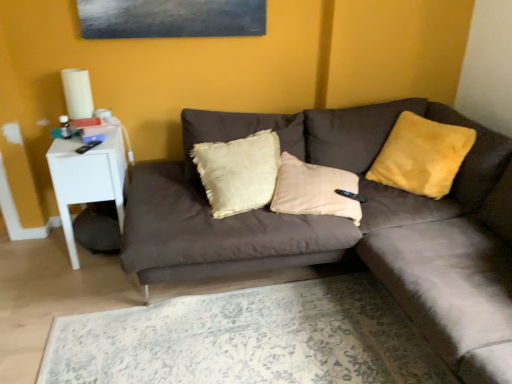
Where is `yellow fuzzy pillow at upper right`? The image size is (512, 384). yellow fuzzy pillow at upper right is located at coordinates (422, 156).

Identify the location of yellow fuzzy pillow at upper right. The width and height of the screenshot is (512, 384). (422, 156).

Considering the sizes of white glossy side table at left and yellow fuzzy pillow at upper right in the image, is white glossy side table at left bigger or smaller than yellow fuzzy pillow at upper right?

Considering their sizes, white glossy side table at left takes up more space than yellow fuzzy pillow at upper right.

Which is correct: white glossy side table at left is inside yellow fuzzy pillow at upper right, or outside of it?

white glossy side table at left is not enclosed by yellow fuzzy pillow at upper right.

Is white glossy side table at left wider or thinner than yellow fuzzy pillow at upper right?

Considering their sizes, white glossy side table at left looks broader than yellow fuzzy pillow at upper right.

From the image's perspective, which is below, white glossy side table at left or yellow fuzzy pillow at upper right?

white glossy side table at left is shown below in the image.

Is velvet brown couch at center turned away from white glossy side table at left?

velvet brown couch at center does not have its back to white glossy side table at left.

Which is more to the left, velvet brown couch at center or white glossy side table at left?

Positioned to the left is white glossy side table at left.

This screenshot has height=384, width=512. Find the location of `table on the left of velvet brown couch at center`. table on the left of velvet brown couch at center is located at coordinates (88, 178).

Is white glossy side table at left closer to camera compared to velvet brown couch at center?

No, it is behind velvet brown couch at center.

Which is correct: white glossy side table at left is inside velvet brown couch at center, or outside of it?

white glossy side table at left cannot be found inside velvet brown couch at center.

From a real-world perspective, who is located lower, white glossy side table at left or velvet brown couch at center?

In real-world perspective, white glossy side table at left is lower.

Based on the photo, how many degrees apart are the facing directions of white glossy side table at left and velvet brown couch at center?

The angle between the facing direction of white glossy side table at left and the facing direction of velvet brown couch at center is 87.5 degrees.

Is velvet brown couch at center closer to camera compared to yellow fuzzy pillow at upper right?

Yes, it is in front of yellow fuzzy pillow at upper right.

Could yellow fuzzy pillow at upper right be considered to be inside velvet brown couch at center?

Absolutely, yellow fuzzy pillow at upper right is inside velvet brown couch at center.

Does velvet brown couch at center have a larger size compared to yellow fuzzy pillow at upper right?

Indeed, velvet brown couch at center has a larger size compared to yellow fuzzy pillow at upper right.

Is velvet brown couch at center facing away from yellow fuzzy pillow at upper right?

Yes, yellow fuzzy pillow at upper right is at the back of velvet brown couch at center.

From the image's perspective, is yellow fuzzy pillow at upper right positioned above or below white glossy side table at left?

Clearly, from the image's perspective, yellow fuzzy pillow at upper right is above white glossy side table at left.

Looking at this image, who is smaller, yellow fuzzy pillow at upper right or white glossy side table at left?

yellow fuzzy pillow at upper right is smaller.

Does yellow fuzzy pillow at upper right have a greater height compared to white glossy side table at left?

Incorrect, the height of yellow fuzzy pillow at upper right is not larger of that of white glossy side table at left.

Is yellow fuzzy pillow at upper right located outside white glossy side table at left?

Indeed, yellow fuzzy pillow at upper right is completely outside white glossy side table at left.

From a real-world perspective, does yellow fuzzy pillow at upper right sit lower than velvet brown couch at center?

Incorrect, from a real-world perspective, yellow fuzzy pillow at upper right is higher than velvet brown couch at center.

Considering the positions of points (461, 156) and (416, 221), is point (461, 156) farther from camera compared to point (416, 221)?

Yes.

Can you confirm if yellow fuzzy pillow at upper right is thinner than velvet brown couch at center?

Indeed, yellow fuzzy pillow at upper right has a lesser width compared to velvet brown couch at center.

How many degrees apart are the facing directions of yellow fuzzy pillow at upper right and velvet brown couch at center?

The facing directions of yellow fuzzy pillow at upper right and velvet brown couch at center are 33.1 degrees apart.

In the image, there is a white glossy side table at left. Identify the location of pillow above it (from the image's perspective). This screenshot has width=512, height=384. (422, 156).

Find the location of a particular element. This screenshot has width=512, height=384. studio couch lying below the white glossy side table at left (from the image's perspective) is located at coordinates (x=350, y=227).

When comparing their distances from velvet brown couch at center, does yellow fuzzy pillow at upper right or white glossy side table at left seem further?

white glossy side table at left.

From the image, which object appears to be farther from yellow fuzzy pillow at upper right, white glossy side table at left or velvet brown couch at center?

Among the two, white glossy side table at left is located further to yellow fuzzy pillow at upper right.

From the image, which object appears to be nearer to white glossy side table at left, yellow fuzzy pillow at upper right or velvet brown couch at center?

The object closer to white glossy side table at left is velvet brown couch at center.

Estimate the real-world distances between objects in this image. Which object is closer to velvet brown couch at center, white glossy side table at left or yellow fuzzy pillow at upper right?

yellow fuzzy pillow at upper right is closer to velvet brown couch at center.

From the picture: Considering their positions, is velvet brown couch at center positioned closer to white glossy side table at left than yellow fuzzy pillow at upper right?

velvet brown couch at center.

Estimate the real-world distances between objects in this image. Which object is closer to yellow fuzzy pillow at upper right, velvet brown couch at center or white glossy side table at left?

The object closer to yellow fuzzy pillow at upper right is velvet brown couch at center.

I want to click on studio couch between white glossy side table at left and yellow fuzzy pillow at upper right, so click(350, 227).